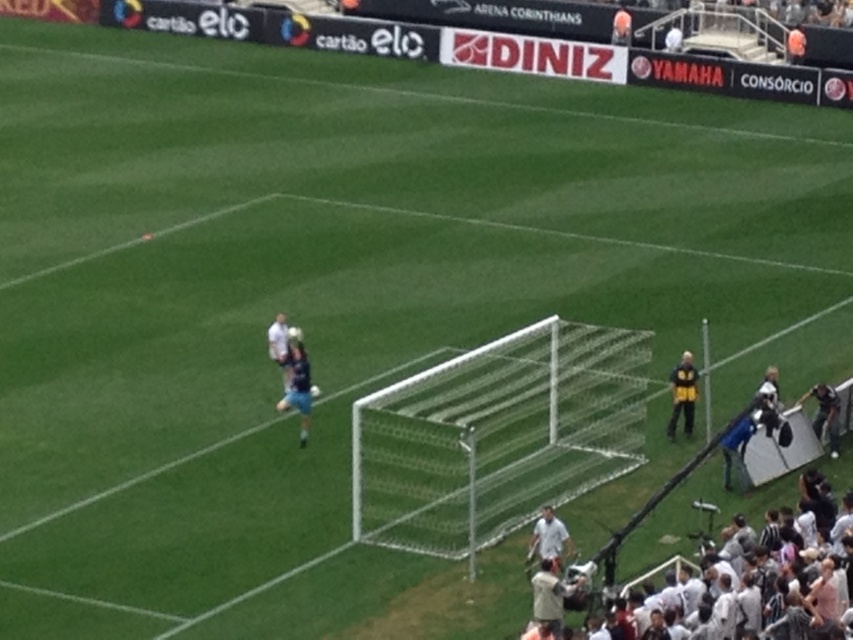
Who is positioned more to the right, blue jersey at center or yellow jacket at right?

Positioned to the right is yellow jacket at right.

Is blue jersey at center shorter than yellow jacket at right?

Incorrect, blue jersey at center's height does not fall short of yellow jacket at right's.

Where is `blue jersey at center`? Image resolution: width=853 pixels, height=640 pixels. blue jersey at center is located at coordinates (299, 387).

Which of these two, white cotton crowd at lower right or blue jersey at center, stands shorter?

white cotton crowd at lower right

Measure the distance between point (610, 564) and camera.

A distance of 22.90 meters exists between point (610, 564) and camera.

I want to click on white cotton crowd at lower right, so click(x=828, y=609).

Is white cotton crowd at lower right wider than yellow jacket at right?

Yes.

From the picture: Is white cotton crowd at lower right closer to the viewer compared to yellow jacket at right?

Yes, white cotton crowd at lower right is closer to the viewer.

Is point (787, 536) positioned after point (686, 384)?

No.

Identify the location of white cotton crowd at lower right. Image resolution: width=853 pixels, height=640 pixels. (828, 609).